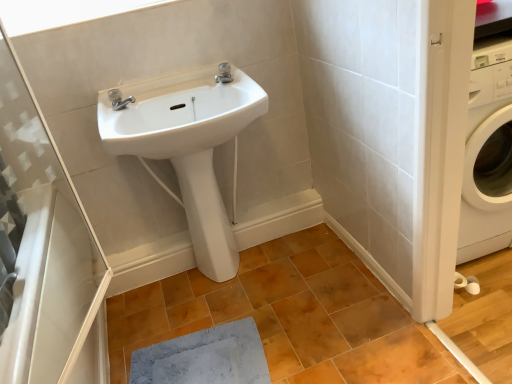
Question: From the image's perspective, does white matte window at upper left appear higher than transparent plastic shower door at left?

Choices:
 (A) yes
 (B) no

Answer: (A)

Question: Does white matte window at upper left have a greater width compared to transparent plastic shower door at left?

Choices:
 (A) yes
 (B) no

Answer: (B)

Question: Is white matte window at upper left looking in the opposite direction of transparent plastic shower door at left?

Choices:
 (A) no
 (B) yes

Answer: (A)

Question: Can you confirm if white matte window at upper left is positioned to the left of transparent plastic shower door at left?

Choices:
 (A) yes
 (B) no

Answer: (B)

Question: From a real-world perspective, is white matte window at upper left positioned under transparent plastic shower door at left based on gravity?

Choices:
 (A) no
 (B) yes

Answer: (A)

Question: Is point (218, 142) positioned closer to the camera than point (418, 365)?

Choices:
 (A) farther
 (B) closer

Answer: (A)

Question: Is white glossy sink at upper center taller or shorter than brown matte tile at center?

Choices:
 (A) tall
 (B) short

Answer: (A)

Question: Considering the positions of white glossy sink at upper center and brown matte tile at center in the image, is white glossy sink at upper center wider or thinner than brown matte tile at center?

Choices:
 (A) wide
 (B) thin

Answer: (B)

Question: Based on their sizes in the image, would you say white glossy sink at upper center is bigger or smaller than brown matte tile at center?

Choices:
 (A) small
 (B) big

Answer: (A)

Question: Is white matte window at upper left taller or shorter than polished chrome faucet at upper center, the 2th tap positioned from the top?

Choices:
 (A) tall
 (B) short

Answer: (B)

Question: In terms of width, does white matte window at upper left look wider or thinner when compared to polished chrome faucet at upper center, the 2th tap positioned from the top?

Choices:
 (A) thin
 (B) wide

Answer: (B)

Question: Visually, is white matte window at upper left positioned to the left or to the right of polished chrome faucet at upper center, placed as the first tap when sorted from left to right?

Choices:
 (A) right
 (B) left

Answer: (B)

Question: From a real-world perspective, is white matte window at upper left above or below polished chrome faucet at upper center, arranged as the second tap when viewed from the right?

Choices:
 (A) above
 (B) below

Answer: (A)

Question: From a real-world perspective, relative to transparent plastic shower door at left, is blue soft mat at lower center vertically above or below?

Choices:
 (A) below
 (B) above

Answer: (A)

Question: Considering their positions, is blue soft mat at lower center located in front of or behind transparent plastic shower door at left?

Choices:
 (A) behind
 (B) front

Answer: (A)